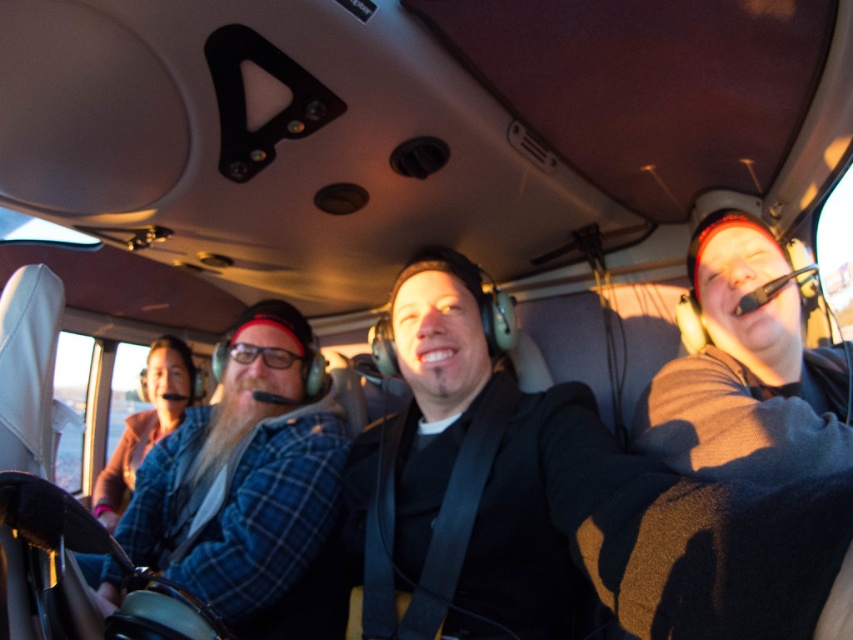
Question: Is blue plaid shirt at center wider than black fleece at right?

Choices:
 (A) no
 (B) yes

Answer: (B)

Question: Which of the following is the closest to the observer?

Choices:
 (A) black fleece at right
 (B) blue plaid shirt at center

Answer: (A)

Question: Among these objects, which one is farthest from the camera?

Choices:
 (A) blue plaid shirt at center
 (B) black fleece at right

Answer: (A)

Question: Which of the following is the closest to the observer?

Choices:
 (A) (317, 497)
 (B) (759, 320)

Answer: (B)

Question: Is blue plaid shirt at center wider than black fleece at right?

Choices:
 (A) yes
 (B) no

Answer: (A)

Question: Can you confirm if blue plaid shirt at center is smaller than black fleece at right?

Choices:
 (A) no
 (B) yes

Answer: (A)